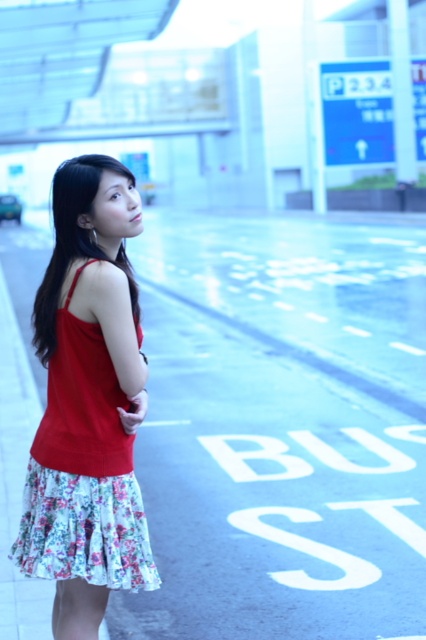
You are a delivery person who needs to place a large package on the ground at the bus stop. The package is as wide as the blue asphalt pavement at center. Can the red floral dress at center fit next to it without overlapping?

The blue asphalt pavement at center is wider than the red floral dress at center. Since the package is as wide as the pavement, there would be insufficient space for the dress to fit next to it without overlapping.

Based on the photo, you are a pedestrian approaching the bus stop and see the blue asphalt pavement at center and the red floral dress at center. Which object is closer to you as you walk towards the bus stop?

The blue asphalt pavement at center is closer to you than the red floral dress at center because it is further to the viewer, meaning it appears nearer in the scene.

You are a pedestrian standing at the bus stop and want to check if you can safely cross the street to reach the blue asphalt pavement at center without getting too close to the red floral dress at center. The safe distance required is 5 meters. Can you proceed?

The distance between the blue asphalt pavement at center and the red floral dress at center is 7.08 meters. Since the required safe distance is 5 meters, you can proceed as the distance is sufficient.